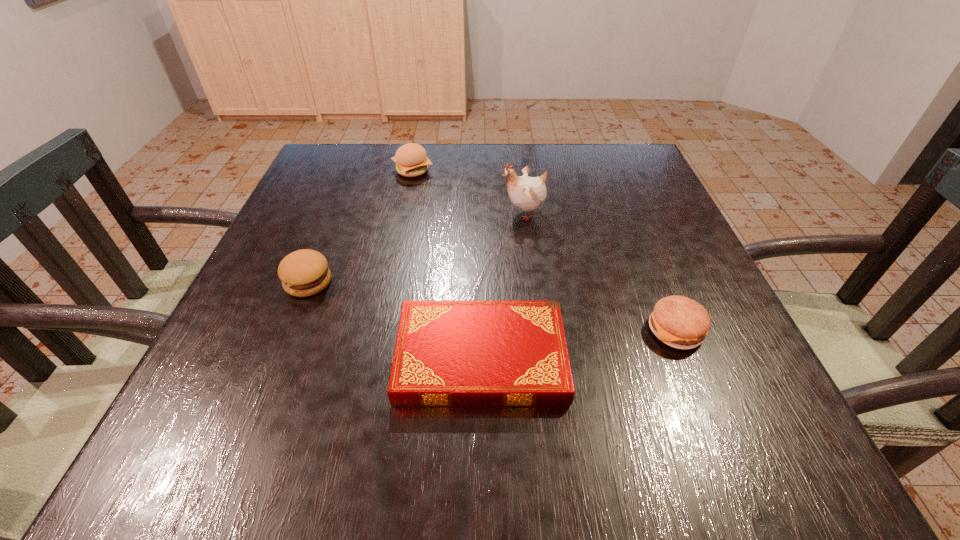
Image resolution: width=960 pixels, height=540 pixels. Find the location of `object positioned at the right edge`. object positioned at the right edge is located at coordinates tap(680, 322).

The image size is (960, 540). Identify the location of free space at the far edge of the desktop. (564, 152).

This screenshot has height=540, width=960. I want to click on free location at the near edge, so click(319, 468).

Locate an element on the screen. vacant position at the left edge of the desktop is located at coordinates (347, 192).

In the image, there is a desktop. Identify the location of blank space at the right edge. (666, 221).

The width and height of the screenshot is (960, 540). Find the location of `free space at the far left corner of the desktop`. free space at the far left corner of the desktop is located at coordinates (320, 161).

In the image, there is a desktop. At what (x,y) coordinates should I click in order to perform the action: click on free region at the far right corner. Please return your answer as a coordinate pair (x, y). Looking at the image, I should click on (588, 151).

This screenshot has height=540, width=960. In the image, there is a desktop. Identify the location of free space at the near right corner. (679, 429).

Image resolution: width=960 pixels, height=540 pixels. Find the location of `free space between the third nearest object and the second hamburger from right to left`. free space between the third nearest object and the second hamburger from right to left is located at coordinates (360, 226).

What are the coordinates of `unoccupied position between the rightmost hamburger and the farthest hamburger` in the screenshot? It's located at (544, 250).